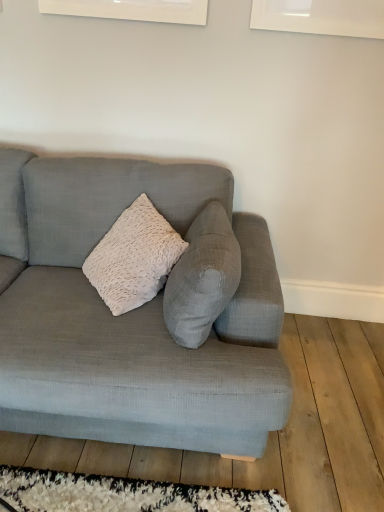
Question: From their relative heights in the image, would you say textured gray couch at center is taller or shorter than white shaggy rug at lower center?

Choices:
 (A) short
 (B) tall

Answer: (B)

Question: In terms of size, does textured gray couch at center appear bigger or smaller than white shaggy rug at lower center?

Choices:
 (A) small
 (B) big

Answer: (B)

Question: From a real-world perspective, is textured gray couch at center physically located above or below white shaggy rug at lower center?

Choices:
 (A) below
 (B) above

Answer: (B)

Question: Looking at the image, does white shaggy rug at lower center seem bigger or smaller compared to textured gray couch at center?

Choices:
 (A) small
 (B) big

Answer: (A)

Question: From a real-world perspective, relative to textured gray couch at center, is white shaggy rug at lower center vertically above or below?

Choices:
 (A) below
 (B) above

Answer: (A)

Question: Would you say white shaggy rug at lower center is to the left or to the right of textured gray couch at center in the picture?

Choices:
 (A) right
 (B) left

Answer: (A)

Question: From the image's perspective, is white shaggy rug at lower center positioned above or below textured gray couch at center?

Choices:
 (A) below
 (B) above

Answer: (A)